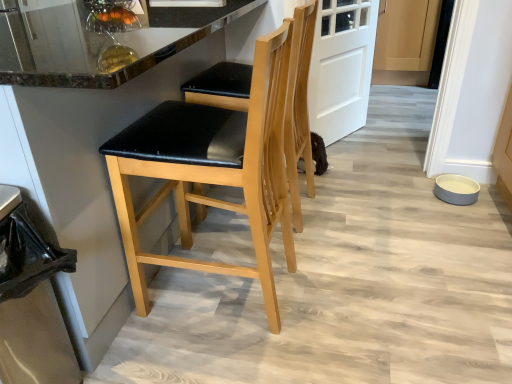
Question: Can you confirm if black plastic trash can at lower left is wider than white matte door at center?

Choices:
 (A) no
 (B) yes

Answer: (B)

Question: Is the depth of black plastic trash can at lower left less than that of white matte door at center?

Choices:
 (A) no
 (B) yes

Answer: (B)

Question: Is black plastic trash can at lower left oriented towards white matte door at center?

Choices:
 (A) yes
 (B) no

Answer: (B)

Question: Does black plastic trash can at lower left have a larger size compared to white matte door at center?

Choices:
 (A) no
 (B) yes

Answer: (A)

Question: Does black plastic trash can at lower left touch white matte door at center?

Choices:
 (A) no
 (B) yes

Answer: (A)

Question: Is black plastic trash can at lower left positioned behind white matte door at center?

Choices:
 (A) yes
 (B) no

Answer: (B)

Question: Are black plastic trash can at lower left and matte black seat at center, placed as the 2th chair when sorted from front to back, beside each other?

Choices:
 (A) no
 (B) yes

Answer: (A)

Question: Is black plastic trash can at lower left smaller than matte black seat at center, placed as the 2th chair when sorted from front to back?

Choices:
 (A) no
 (B) yes

Answer: (B)

Question: Can you confirm if black plastic trash can at lower left is positioned to the right of matte black seat at center, placed as the 2th chair when sorted from front to back?

Choices:
 (A) yes
 (B) no

Answer: (B)

Question: Would you consider black plastic trash can at lower left to be distant from matte black seat at center, placed as the first chair when sorted from back to front?

Choices:
 (A) yes
 (B) no

Answer: (A)

Question: Can you confirm if black plastic trash can at lower left is positioned to the left of matte black seat at center, placed as the 2th chair when sorted from front to back?

Choices:
 (A) yes
 (B) no

Answer: (A)

Question: From a real-world perspective, is black plastic trash can at lower left located beneath matte black seat at center, placed as the 2th chair when sorted from front to back?

Choices:
 (A) yes
 (B) no

Answer: (A)

Question: Is white matte door at center at the right side of light wood cabinet at center?

Choices:
 (A) no
 (B) yes

Answer: (A)